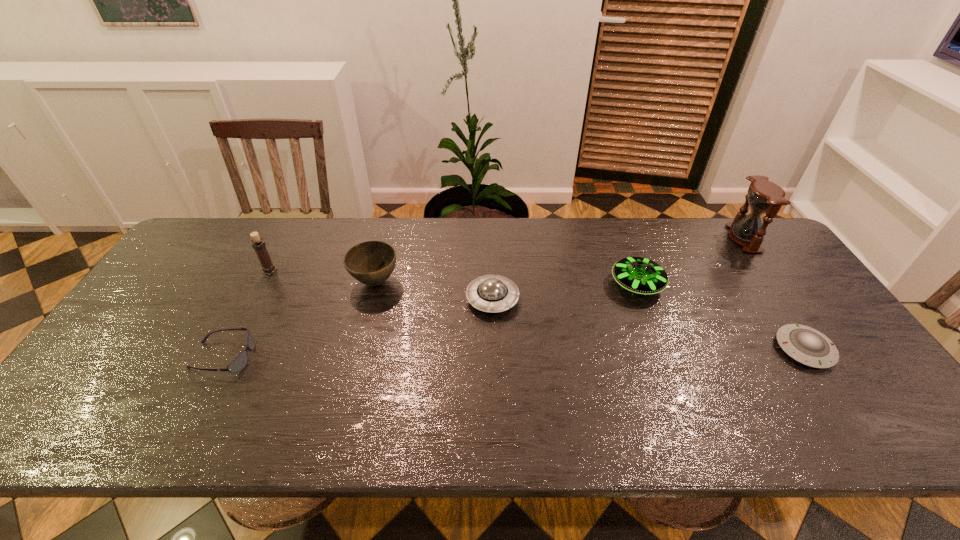
You are a GUI agent. You are given a task and a screenshot of the screen. Output one action in this format:
    pyautogui.click(x=<x>, y=<y>)
    Task: Click on the tallest object
    
    Given the screenshot: What is the action you would take?
    pyautogui.click(x=764, y=196)

At what (x,y) coordinates should I click in order to perform the action: click on hourglass. Please return your answer as a coordinate pair (x, y). Looking at the image, I should click on (764, 196).

This screenshot has height=540, width=960. In order to click on the second tallest object in this screenshot , I will do `click(259, 246)`.

Identify the location of the third object from left to right. click(372, 262).

You are a GUI agent. You are given a task and a screenshot of the screen. Output one action in this format:
    pyautogui.click(x=<x>, y=<y>)
    Task: Click on the fifth shortest object
    
    Given the screenshot: What is the action you would take?
    pyautogui.click(x=372, y=262)

The image size is (960, 540). Identify the location of the tallest saucer. (639, 275).

The image size is (960, 540). In order to click on the fifth object from left to right in this screenshot , I will do `click(639, 275)`.

The image size is (960, 540). I want to click on the fifth tallest object, so tap(490, 293).

I want to click on the second tallest saucer, so click(x=490, y=293).

You are a GUI agent. You are given a task and a screenshot of the screen. Output one action in this format:
    pyautogui.click(x=<x>, y=<y>)
    Task: Click on the sunglasses
    The width and height of the screenshot is (960, 540).
    Given the screenshot: What is the action you would take?
    pyautogui.click(x=239, y=363)